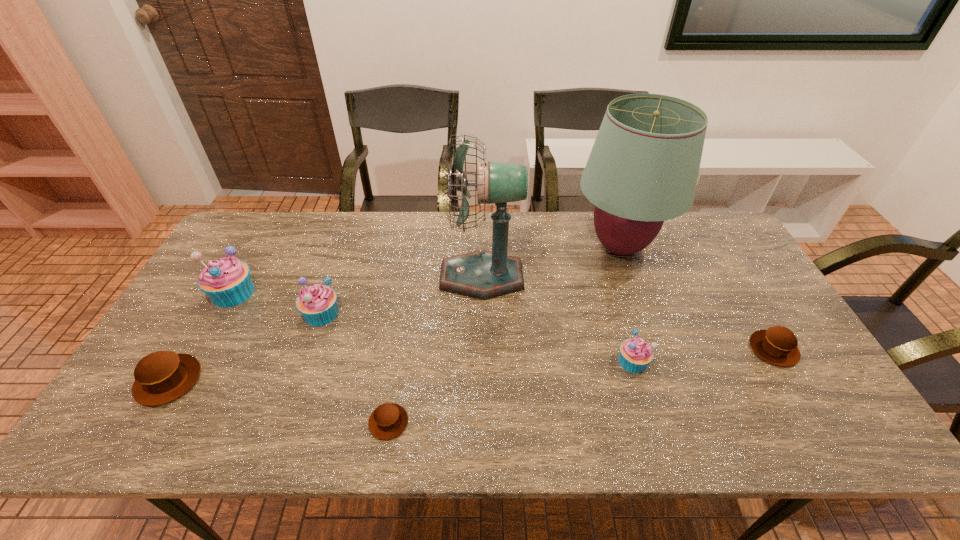
Identify the location of vacant region between the rightmost brown muffin and the blue lampshade. This screenshot has height=540, width=960. (697, 298).

Locate an element on the screen. empty space that is in between the lampshade and the rightmost blue muffin is located at coordinates (626, 304).

The width and height of the screenshot is (960, 540). Identify the location of unoccupied position between the rightmost blue muffin and the leftmost brown muffin. (400, 371).

Point out which object is positioned as the nearest to the rightmost blue muffin. Please provide its 2D coordinates. Your answer should be formatted as a tuple, i.e. [(x, y)], where the tuple contains the x and y coordinates of a point satisfying the conditions above.

[(643, 168)]

Identify which object is the nearest to the fifth muffin from left to right. Please provide its 2D coordinates. Your answer should be formatted as a tuple, i.e. [(x, y)], where the tuple contains the x and y coordinates of a point satisfying the conditions above.

[(643, 168)]

The width and height of the screenshot is (960, 540). What are the coordinates of `muffin that is the second closest to the smallest blue muffin` in the screenshot? It's located at (389, 420).

The image size is (960, 540). Identify the location of the third closest muffin to the fifth shortest object. (389, 420).

Point out which blue muffin is positioned as the nearest to the leftmost brown muffin. Please provide its 2D coordinates. Your answer should be formatted as a tuple, i.e. [(x, y)], where the tuple contains the x and y coordinates of a point satisfying the conditions above.

[(227, 282)]

Locate which blue muffin is the closest to the shortest muffin. Please provide its 2D coordinates. Your answer should be formatted as a tuple, i.e. [(x, y)], where the tuple contains the x and y coordinates of a point satisfying the conditions above.

[(317, 303)]

Identify the location of brown muffin that is the closest one to the biggest brown muffin. The width and height of the screenshot is (960, 540). point(389,420).